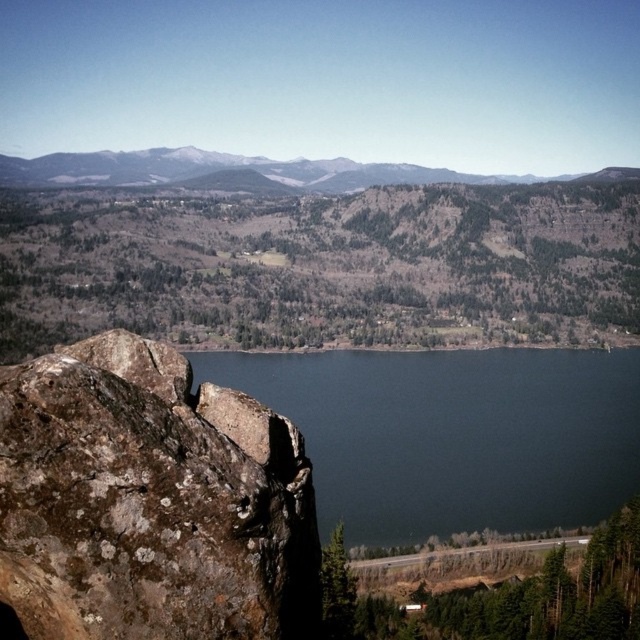
You are planning to take a photo of the dark blue water at center and the snowy rocky mountain at upper center. Which object will appear wider in the photo?

The snowy rocky mountain at upper center will appear wider in the photo because its width is greater than the dark blue water at center.

You are a hiker standing at the edge of the lake. You see the brown rough rock at left and the dark blue water at center. Which object is taller?

The dark blue water at center is taller than the brown rough rock at left.